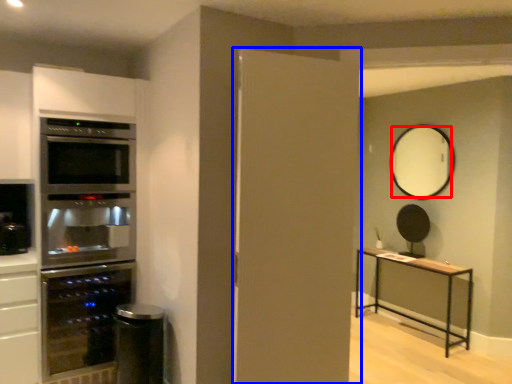
Question: Which of the following is the closest to the observer, mirror (highlighted by a red box) or door (highlighted by a blue box)?

Choices:
 (A) mirror
 (B) door

Answer: (B)